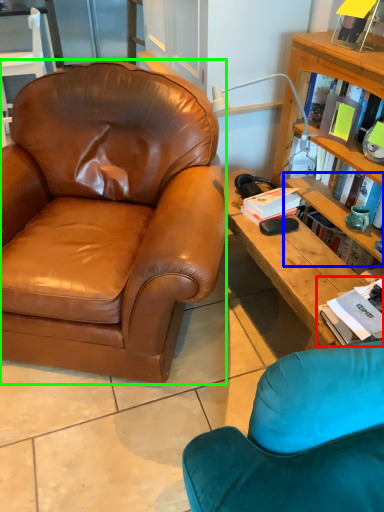
Question: Based on their relative distances, which object is farther from book (highlighted by a red box)? Choose from shelf (highlighted by a blue box) and chair (highlighted by a green box).

Choices:
 (A) shelf
 (B) chair

Answer: (B)